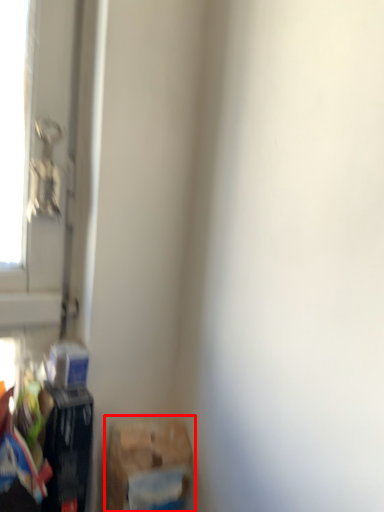
Question: In this image, where is waste (annotated by the red box) located relative to waste?

Choices:
 (A) left
 (B) right

Answer: (B)